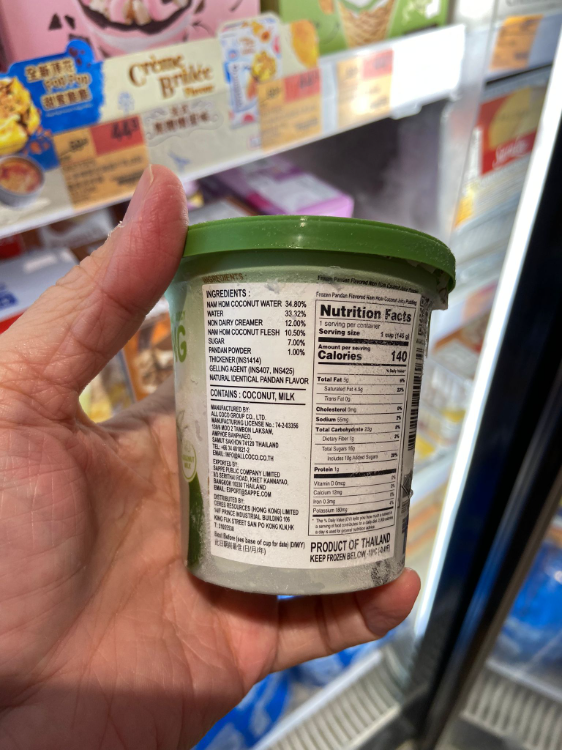
Identify the location of black frame of freezer. coord(552,258), coord(486,523), coord(429,691).